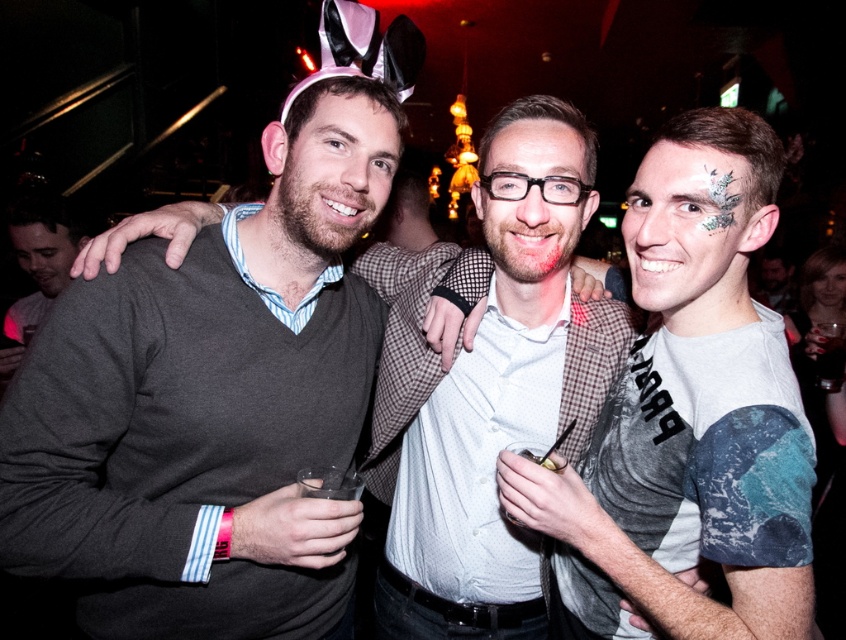
Is point (58, 387) positioned behind point (31, 264)?

No, (58, 387) is in front of (31, 264).

Based on the photo, can you confirm if dark gray sweater at center is shorter than matte gray sweater at center?

No, dark gray sweater at center is not shorter than matte gray sweater at center.

Where is `dark gray sweater at center`? This screenshot has width=846, height=640. dark gray sweater at center is located at coordinates (212, 403).

Locate an element on the screen. The width and height of the screenshot is (846, 640). dark gray sweater at center is located at coordinates (212, 403).

Is gray matte t-shirt at center wider than matte gray sweater at center?

Yes, gray matte t-shirt at center is wider than matte gray sweater at center.

This screenshot has height=640, width=846. What do you see at coordinates (688, 416) in the screenshot?
I see `gray matte t-shirt at center` at bounding box center [688, 416].

Identify the location of gray matte t-shirt at center. (688, 416).

Can you confirm if dark gray sweater at center is bigger than gray matte t-shirt at center?

Yes.

Can you confirm if dark gray sweater at center is positioned below gray matte t-shirt at center?

Actually, dark gray sweater at center is above gray matte t-shirt at center.

This screenshot has width=846, height=640. Find the location of `dark gray sweater at center`. dark gray sweater at center is located at coordinates (212, 403).

Where is `dark gray sweater at center`? This screenshot has width=846, height=640. dark gray sweater at center is located at coordinates (212, 403).